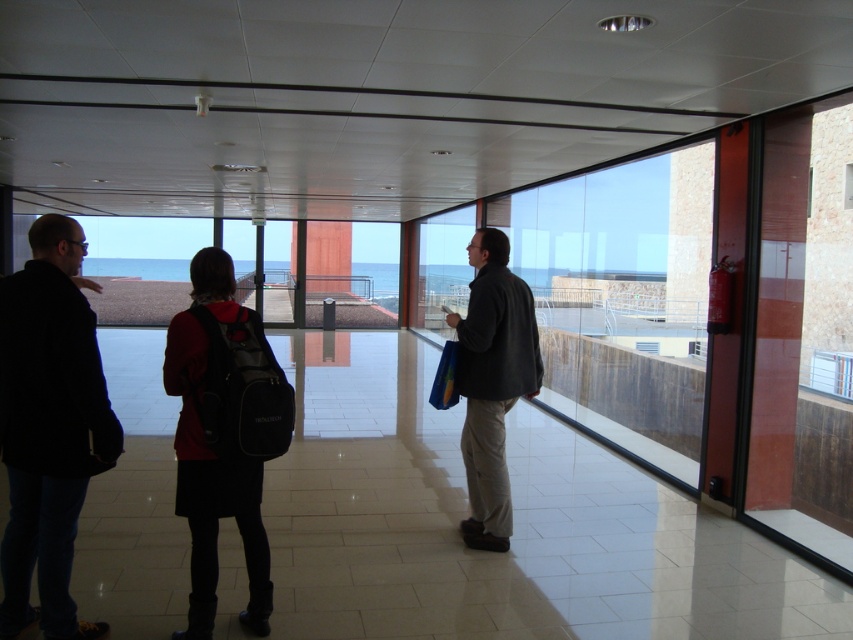
You are a photographer wanting to capture a clear view of the sea outside through the clear glass window at center. However, there is a person wearing a dark gray fabric jacket at center in the way. Can you still see the sea through the window?

The dark gray fabric jacket at center is in front of the clear glass window at center, so the jacket is blocking the view of the sea through the window.

You are standing in the room and want to find the dark gray jacket at left. Based on the coordinates provided, where would you look to find it?

The dark gray jacket at left is located at the 2D coordinates of point (x=49, y=426).

From the picture: You are standing in the room and want to determine the relative positions of two points marked in the image. Which point is closer to you, point 1 at coordinates point (476,385) or point 2 at coordinates point (845,369)?

Point 1 at coordinates point (476,385) is closer to you than point 2 at coordinates point (845,369).